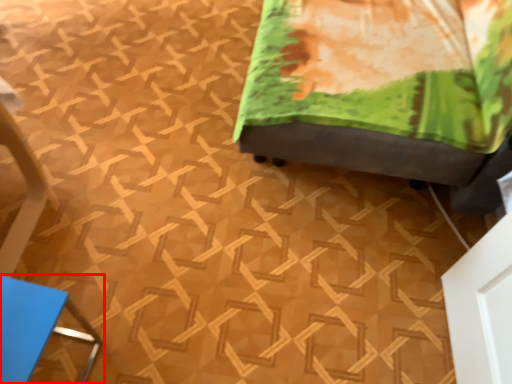
Question: In this image, where is furniture (annotated by the red box) located relative to furniture?

Choices:
 (A) left
 (B) right

Answer: (A)